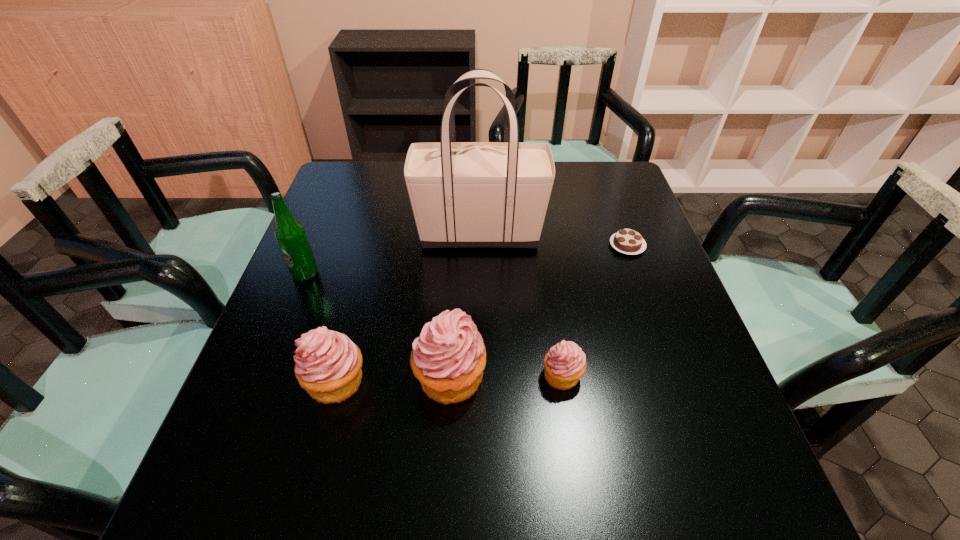
This screenshot has width=960, height=540. I want to click on vacant area at the far edge, so click(402, 191).

Image resolution: width=960 pixels, height=540 pixels. I want to click on blank space at the near edge of the desktop, so click(x=595, y=431).

Identify the location of vacant point at the left edge. (338, 214).

In the image, there is a desktop. Identify the location of vacant space at the near left corner. The width and height of the screenshot is (960, 540). (276, 447).

This screenshot has height=540, width=960. What are the coordinates of `vacant space at the far right corner of the desktop` in the screenshot? It's located at (635, 205).

Where is `vacant region at the near right corner of the desktop`? vacant region at the near right corner of the desktop is located at coordinates [x=655, y=420].

Image resolution: width=960 pixels, height=540 pixels. I want to click on empty location between the shopping bag and the rightmost cupcake, so click(x=521, y=304).

You are a GUI agent. You are given a task and a screenshot of the screen. Output one action in this format:
    pyautogui.click(x=<x>, y=<y>)
    Task: Click on the free area in between the rightmost cupcake and the second cupcake from left to right
    
    Given the screenshot: What is the action you would take?
    pyautogui.click(x=506, y=376)

The image size is (960, 540). I want to click on blank region between the second cupcake from left to right and the tallest object, so click(465, 306).

What are the coordinates of `free point between the leftmost object and the tallest object` in the screenshot? It's located at (393, 253).